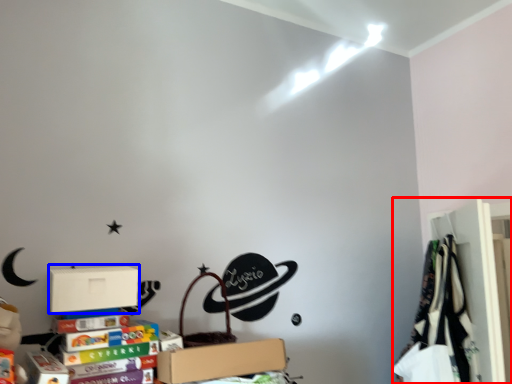
Question: Which of the following is the closest to the observer, closet (highlighted by a red box) or cardboard box (highlighted by a blue box)?

Choices:
 (A) closet
 (B) cardboard box

Answer: (B)